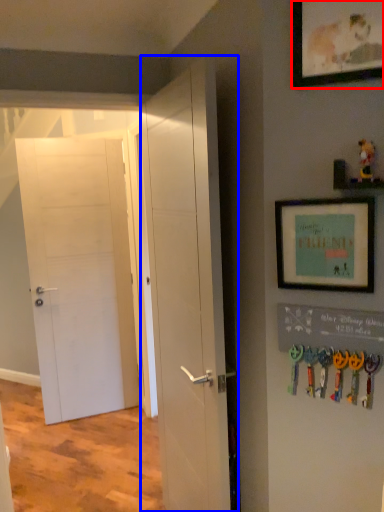
Question: Among these objects, which one is farthest to the camera, picture frame (highlighted by a red box) or door (highlighted by a blue box)?

Choices:
 (A) picture frame
 (B) door

Answer: (B)